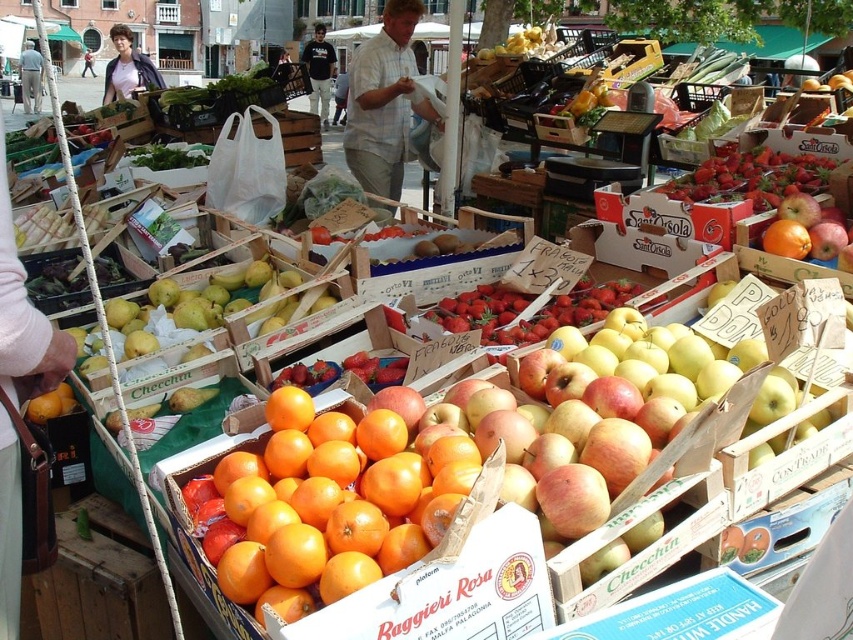
You are a photographer trying to capture both the dark gray sweatshirt at center and the green leafy at center in a single shot. Given their sizes, which object will require you to adjust your camera focus more to ensure clarity?

The dark gray sweatshirt at center is larger in size than the green leafy at center, so you will need to adjust your camera focus more on the dark gray sweatshirt at center to ensure clarity.

You are a customer at the market and want to buy some green leafy vegetables. The market vendor uses a coordinate system where the bottom left corner of the image is the origin. The vendor says that the green leafy vegetables are located at point [228,92]. Can you confirm if this point is indeed on the green leafy vegetables?

Yes, the point [228,92] is on the green leafy vegetables at center, so the vendor is correct.